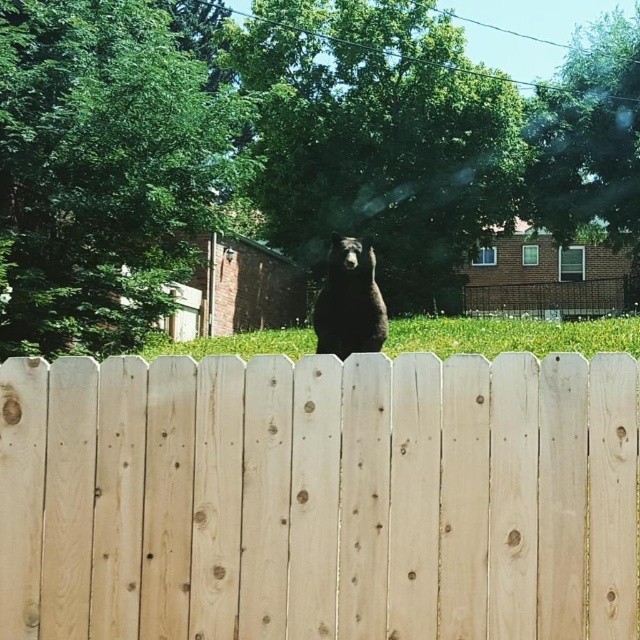
You are a wildlife photographer trying to capture a clear photo of the black furry bear at center. However, the light brown wood fence at center is blocking your view. Can you estimate if the fence is large enough to completely hide the bear from your camera?

The light brown wood fence at center is bigger than the black furry bear at center, so it can completely hide the bear from your camera.

You are standing behind a light brown wood fence at center and want to place a small potted plant exactly at point (x=320, y=497). Is there enough space to place the plant there?

At point (x=320, y=497) lies light brown wood fence at center, so there is no space to place the plant there as the location is occupied by the fence.

You are a photographer trying to capture a clear photo of the black furry bear at center without the light brown wood fence at center blocking the view. Can you move to a position where the fence is not in front of the bear?

The light brown wood fence at center is in front of the black furry bear at center, so you cannot move to a position where the fence is not blocking the bear from your current viewpoint.